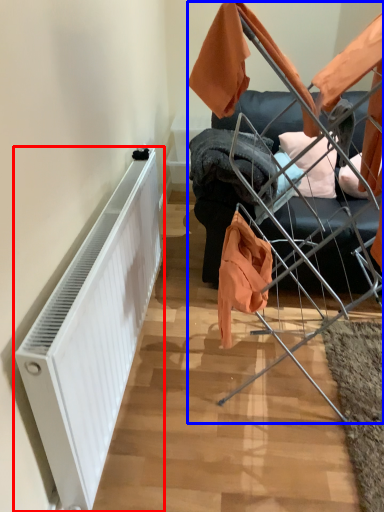
Question: Which object is closer to the camera taking this photo, radiator (highlighted by a red box) or baby carriage (highlighted by a blue box)?

Choices:
 (A) radiator
 (B) baby carriage

Answer: (A)